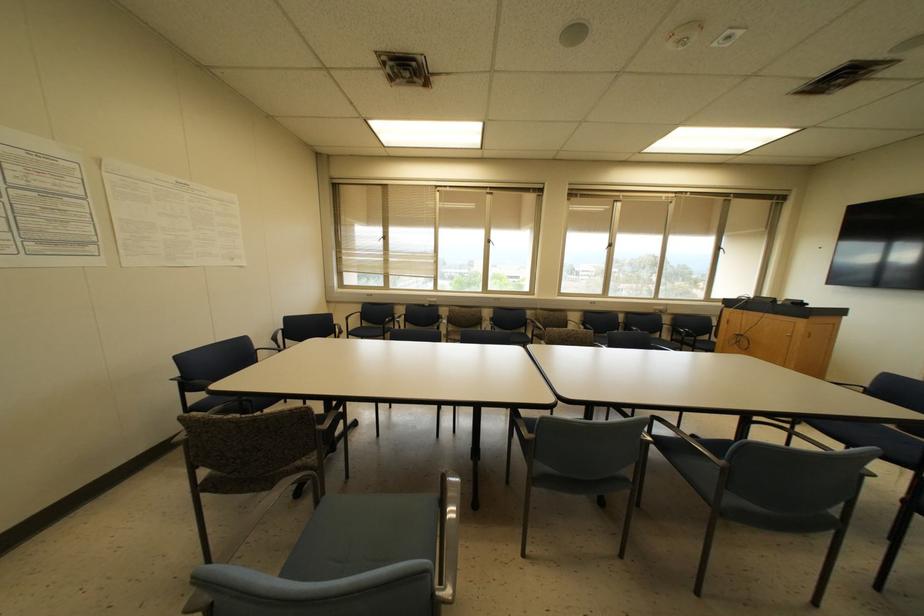
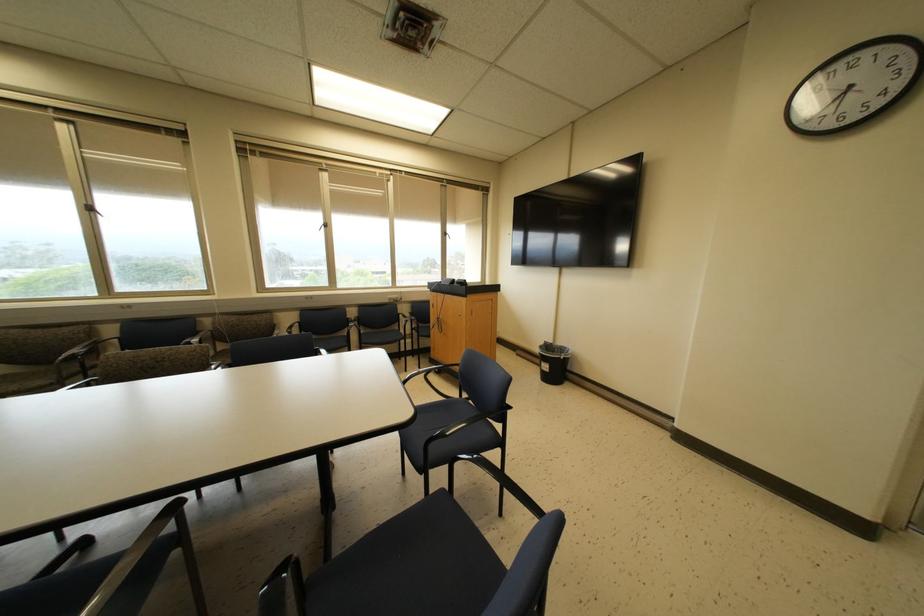
Where in the second image is the point corresponding to [487,241] from the first image?

(89, 208)